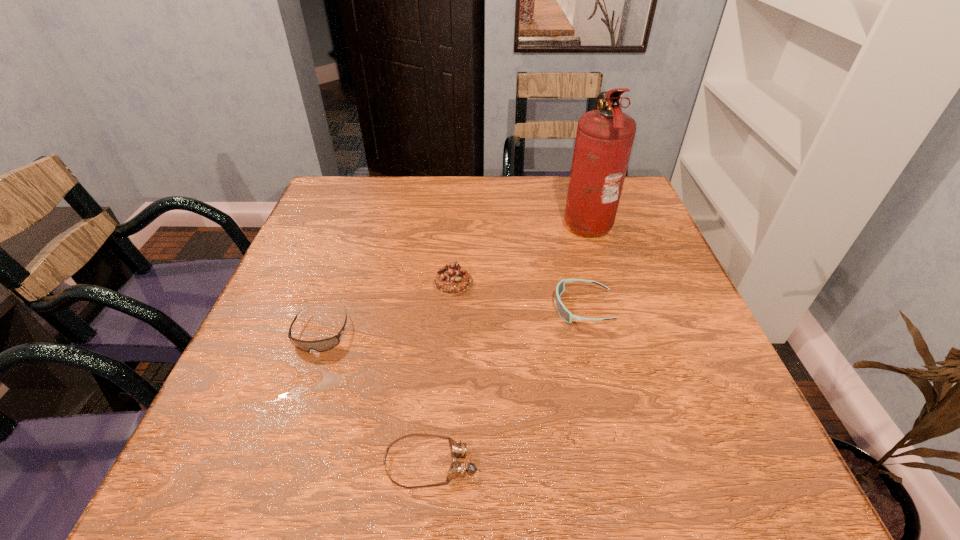
Find the location of a particular element. The height and width of the screenshot is (540, 960). vacant space located 0.230m on the left of the chocolate cake is located at coordinates click(331, 283).

The width and height of the screenshot is (960, 540). Identify the location of free space located 0.160m on the front-facing side of the rightmost goggles. (479, 308).

At what (x,y) coordinates should I click in order to perform the action: click on free space located 0.200m on the front-facing side of the rightmost goggles. Please return your answer as a coordinate pair (x, y). This screenshot has width=960, height=540. Looking at the image, I should click on (460, 308).

Where is `free spot located on the front-facing side of the rightmost goggles`? The width and height of the screenshot is (960, 540). free spot located on the front-facing side of the rightmost goggles is located at coordinates (399, 308).

The height and width of the screenshot is (540, 960). What are the coordinates of `free space located on the lenses of the leftmost goggles` in the screenshot? It's located at (291, 421).

Identify the location of vacant space located on the front lenses and sides of the nearest object. (579, 463).

Identify the location of object that is at the far edge. The height and width of the screenshot is (540, 960). (604, 139).

Image resolution: width=960 pixels, height=540 pixels. In order to click on object present at the near edge in this screenshot , I will do `click(458, 449)`.

Locate an element on the screen. object at the left edge is located at coordinates (326, 344).

This screenshot has height=540, width=960. In order to click on object located at the right edge in this screenshot , I will do 604,139.